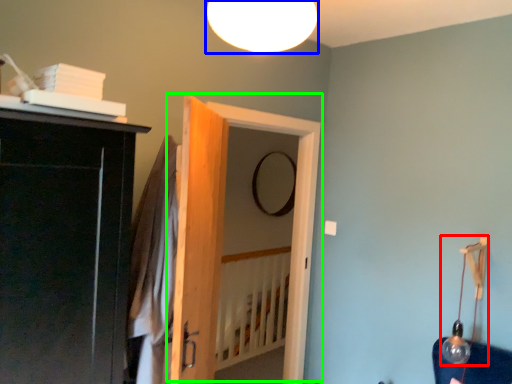
Question: Which object is positioned farthest from lamp (highlighted by a red box)? Select from lamp (highlighted by a blue box) and door (highlighted by a green box).

Choices:
 (A) lamp
 (B) door

Answer: (A)